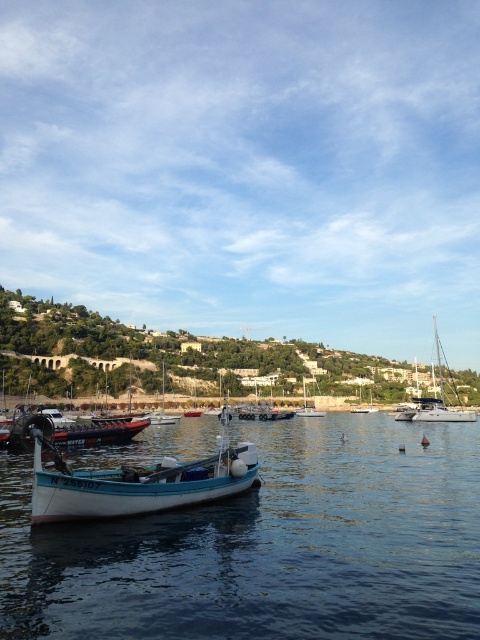
You are standing at the center of the image and want to reach the point at coordinates point (436,400). Which object must you walk through to get there?

The point (436,400) is on white glossy sailboat at right, so you must walk through the white glossy sailboat at right to reach that point.

You are standing at the point with coordinates point [162,417] in the harbor scene. There is another point at point [408,419]. Which point is farther away from you?

Point [408,419] is behind point [162,417], so it is farther away from you.